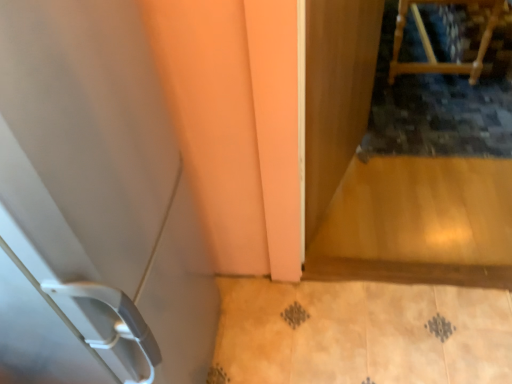
The height and width of the screenshot is (384, 512). Describe the element at coordinates (430, 43) in the screenshot. I see `wooden chair at upper right` at that location.

At what (x,y) coordinates should I click in order to perform the action: click on transparent wooden screen door at upper right. Please return your answer as a coordinate pair (x, y). Looking at the image, I should click on (336, 93).

Where is `wooden chair at upper right`? wooden chair at upper right is located at coordinates click(x=430, y=43).

Considering the positions of point (340, 173) and point (114, 78), is point (340, 173) closer or farther from the camera than point (114, 78)?

Point (340, 173) is farther from the camera than point (114, 78).

Based on the photo, how distant is transparent wooden screen door at upper right from white plastic door at left?

transparent wooden screen door at upper right and white plastic door at left are 31.99 inches apart.

From a real-world perspective, is transparent wooden screen door at upper right above or below white plastic door at left?

Clearly, from a real-world perspective, transparent wooden screen door at upper right is below white plastic door at left.

Is transparent wooden screen door at upper right far away from white plastic door at left?

They are positioned close to each other.

Where is `screen door lying on the right of white plastic door at left`? The width and height of the screenshot is (512, 384). screen door lying on the right of white plastic door at left is located at coordinates (336, 93).

From the image's perspective, is white plastic door at left under transparent wooden screen door at upper right?

Indeed, from the image's perspective, white plastic door at left is shown beneath transparent wooden screen door at upper right.

What's the angular difference between white plastic door at left and transparent wooden screen door at upper right's facing directions?

The angular difference between white plastic door at left and transparent wooden screen door at upper right is 20.6 degrees.

Could you tell me if white plastic door at left is facing transparent wooden screen door at upper right?

No, white plastic door at left is not aimed at transparent wooden screen door at upper right.

At what (x,y) coordinates should I click in order to perform the action: click on door in front of the wooden chair at upper right. Please return your answer as a coordinate pair (x, y). Looking at the image, I should click on (81, 141).

Choose the correct answer: Is white plastic door at left inside wooden chair at upper right or outside it?

white plastic door at left is not inside wooden chair at upper right, it's outside.

Who is shorter, white plastic door at left or wooden chair at upper right?

wooden chair at upper right.

From a real-world perspective, is white plastic door at left physically above wooden chair at upper right?

Yes, from a real-world perspective, white plastic door at left is above wooden chair at upper right.

Would you say wooden chair at upper right is part of transparent wooden screen door at upper right's contents?

No, wooden chair at upper right is not a part of transparent wooden screen door at upper right.

Is the position of transparent wooden screen door at upper right less distant than that of wooden chair at upper right?

That is True.

Is point (322, 169) in front of point (439, 63)?

Yes, it is.

How different are the orientations of transparent wooden screen door at upper right and wooden chair at upper right in degrees?

The angular difference between transparent wooden screen door at upper right and wooden chair at upper right is 21.3 degrees.

Is wooden chair at upper right aimed at white plastic door at left?

No, wooden chair at upper right is not aimed at white plastic door at left.

From the image's perspective, would you say wooden chair at upper right is shown under white plastic door at left?

Incorrect, from the image's perspective, wooden chair at upper right is higher than white plastic door at left.

How many degrees apart are the facing directions of wooden chair at upper right and white plastic door at left?

The angular difference between wooden chair at upper right and white plastic door at left is 0.672 degrees.

How much distance is there between wooden chair at upper right and white plastic door at left?

wooden chair at upper right is 2.23 meters from white plastic door at left.

How far apart are wooden chair at upper right and transparent wooden screen door at upper right?

A distance of 3.35 feet exists between wooden chair at upper right and transparent wooden screen door at upper right.

Is wooden chair at upper right positioned beyond the bounds of transparent wooden screen door at upper right?

wooden chair at upper right lies outside transparent wooden screen door at upper right's area.

From a real-world perspective, is wooden chair at upper right physically below transparent wooden screen door at upper right?

Yes.

Considering the sizes of objects wooden chair at upper right and transparent wooden screen door at upper right in the image provided, who is shorter, wooden chair at upper right or transparent wooden screen door at upper right?

wooden chair at upper right is shorter.

The height and width of the screenshot is (384, 512). Find the location of `door above the transparent wooden screen door at upper right (from a real-world perspective)`. door above the transparent wooden screen door at upper right (from a real-world perspective) is located at coordinates (81, 141).

I want to click on screen door on the right of the white plastic door at left, so click(336, 93).

Considering their positions, is wooden chair at upper right positioned further to transparent wooden screen door at upper right than white plastic door at left?

Based on the image, wooden chair at upper right appears to be further to transparent wooden screen door at upper right.

When comparing their distances from wooden chair at upper right, does transparent wooden screen door at upper right or white plastic door at left seem further?

white plastic door at left is positioned further to the anchor wooden chair at upper right.

Estimate the real-world distances between objects in this image. Which object is closer to transparent wooden screen door at upper right, white plastic door at left or wooden chair at upper right?

Among the two, white plastic door at left is located nearer to transparent wooden screen door at upper right.

Looking at the image, which one is located closer to white plastic door at left, transparent wooden screen door at upper right or wooden chair at upper right?

transparent wooden screen door at upper right.

Which object lies nearer to the anchor point white plastic door at left, wooden chair at upper right or transparent wooden screen door at upper right?

transparent wooden screen door at upper right.

Estimate the real-world distances between objects in this image. Which object is further from wooden chair at upper right, white plastic door at left or transparent wooden screen door at upper right?

white plastic door at left is positioned further to the anchor wooden chair at upper right.

The width and height of the screenshot is (512, 384). What are the coordinates of `screen door between white plastic door at left and wooden chair at upper right along the z-axis` in the screenshot? It's located at (336, 93).